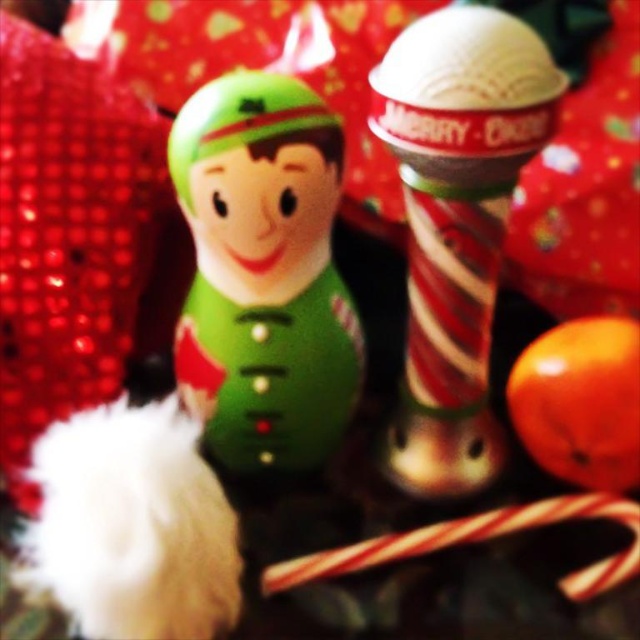
Question: Considering the real-world distances, which object is closest to the white striped candy cane at lower center?

Choices:
 (A) shiny red and white striped candy cane at center
 (B) matte green plush at center

Answer: (A)

Question: Which point appears farthest from the camera in this image?

Choices:
 (A) (451, 24)
 (B) (488, 536)
 (C) (256, 348)

Answer: (B)

Question: Among these objects, which one is nearest to the camera?

Choices:
 (A) matte green plush at center
 (B) white striped candy cane at lower center
 (C) shiny red and white striped candy cane at center

Answer: (C)

Question: From the image, what is the correct spatial relationship of matte green plush at center in relation to shiny red and white striped candy cane at center?

Choices:
 (A) left
 (B) right

Answer: (A)

Question: Is shiny red and white striped candy cane at center smaller than white striped candy cane at lower center?

Choices:
 (A) yes
 (B) no

Answer: (B)

Question: Can you confirm if matte green plush at center is bigger than shiny red and white striped candy cane at center?

Choices:
 (A) yes
 (B) no

Answer: (B)